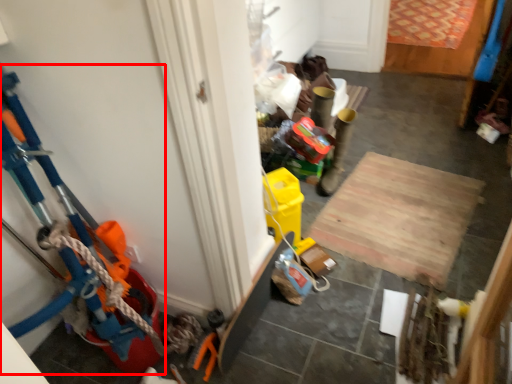
Question: From the image's perspective, considering the relative positions of toy (annotated by the red box) and plywood in the image provided, where is toy (annotated by the red box) located with respect to the staircase?

Choices:
 (A) below
 (B) above

Answer: (B)